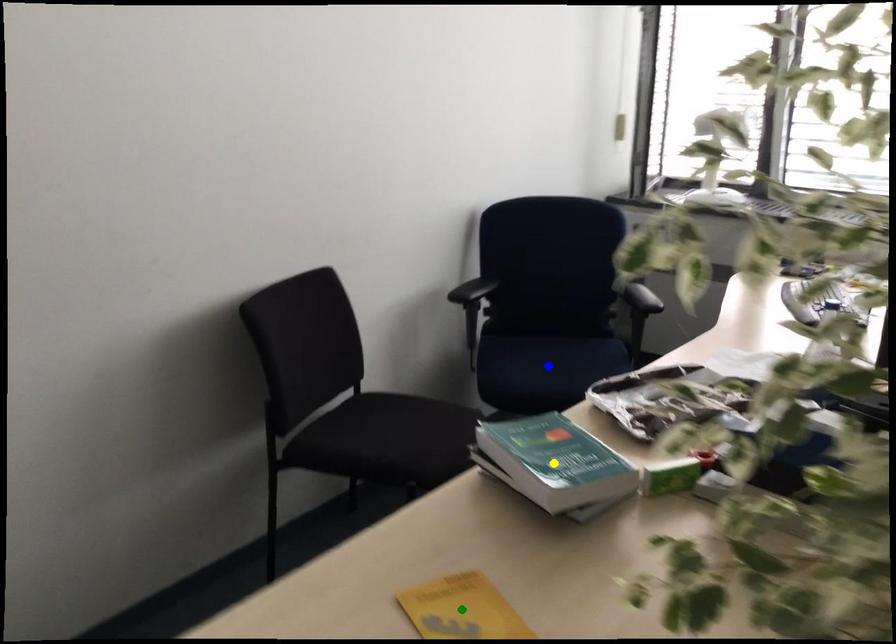
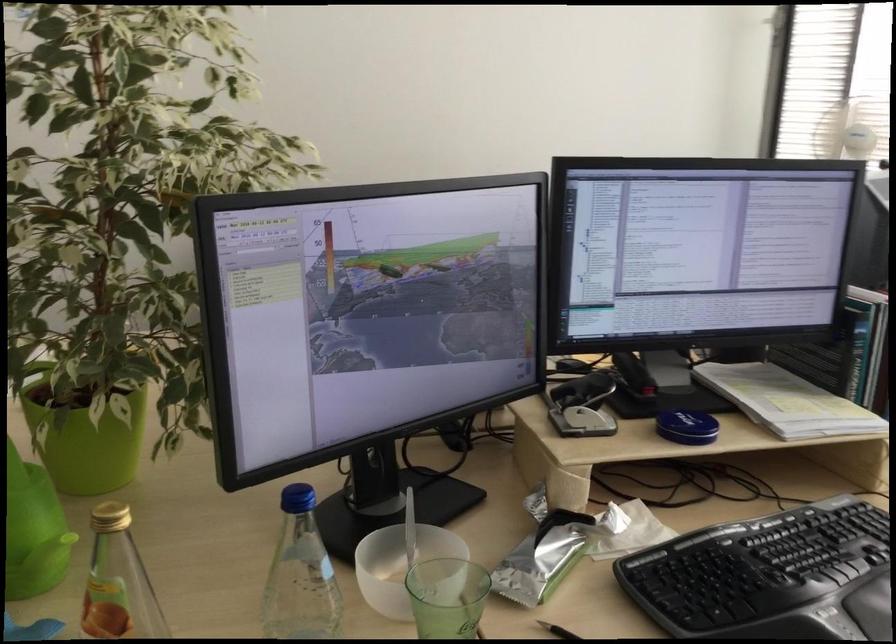
I am providing you with two images of the same scene from different viewpoints. Three points are marked in image1. Which point corresponds to a part or object that is occluded in image2?In image1, three points are marked. Which of them correspond to a part or object that is occluded in image2?Among the three points shown in image1, which one corresponds to a part or object that is no longer visible due to occlusion in image2?

Invisible in image2: green point, yellow point, blue point.